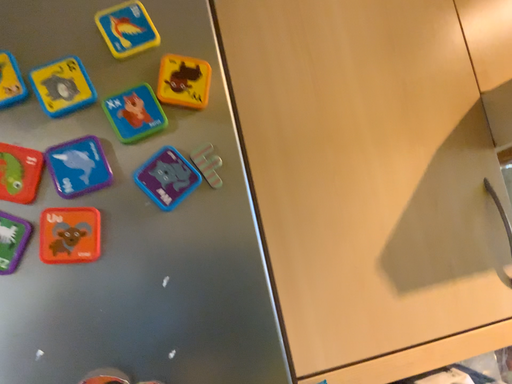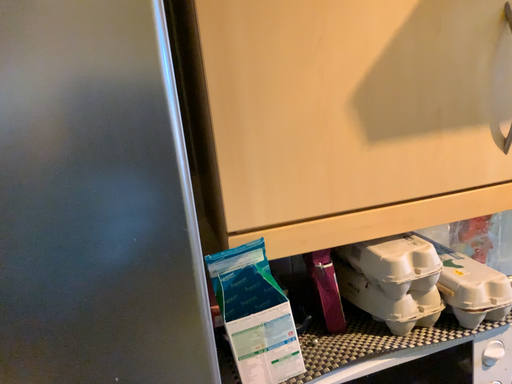
Question: Which way did the camera rotate in the video?

Choices:
 (A) rotated downward
 (B) rotated upward

Answer: (A)